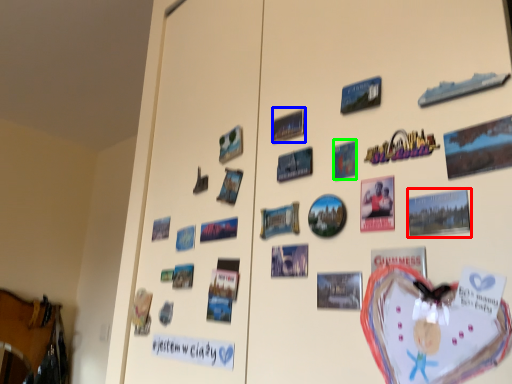
Question: Which object is the closest to the postcard (highlighted by a red box)? Choose among these: poster (highlighted by a blue box) or postcard (highlighted by a green box).

Choices:
 (A) poster
 (B) postcard

Answer: (B)